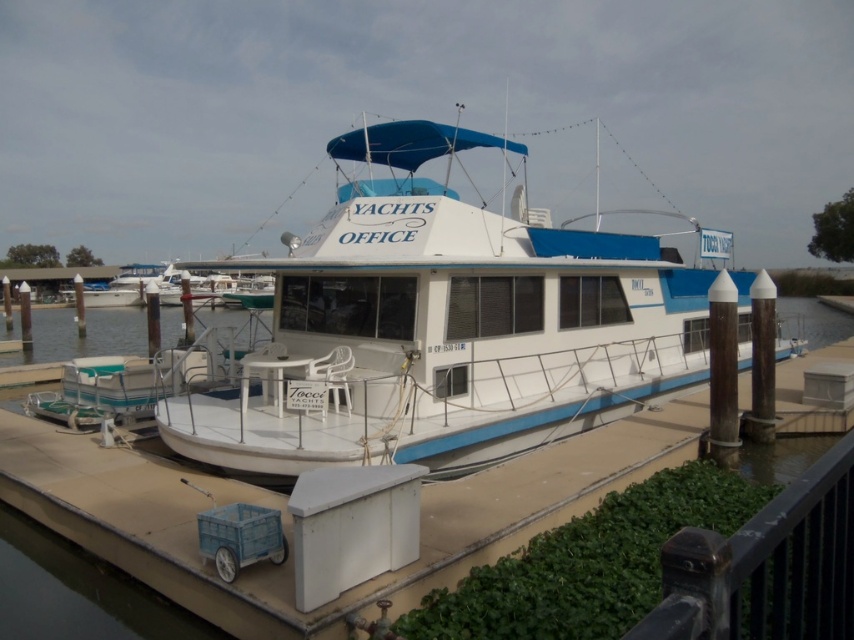
Question: Can you confirm if white matte boat at center is wider than black metal/rail at lower right?

Choices:
 (A) no
 (B) yes

Answer: (B)

Question: Can you confirm if white matte boat at center is positioned above black metal/rail at lower right?

Choices:
 (A) no
 (B) yes

Answer: (B)

Question: Which object appears farthest from the camera in this image?

Choices:
 (A) white matte boat at center
 (B) black metal/rail at lower right

Answer: (A)

Question: Can you confirm if white matte boat at center is positioned to the left of black metal/rail at lower right?

Choices:
 (A) no
 (B) yes

Answer: (B)